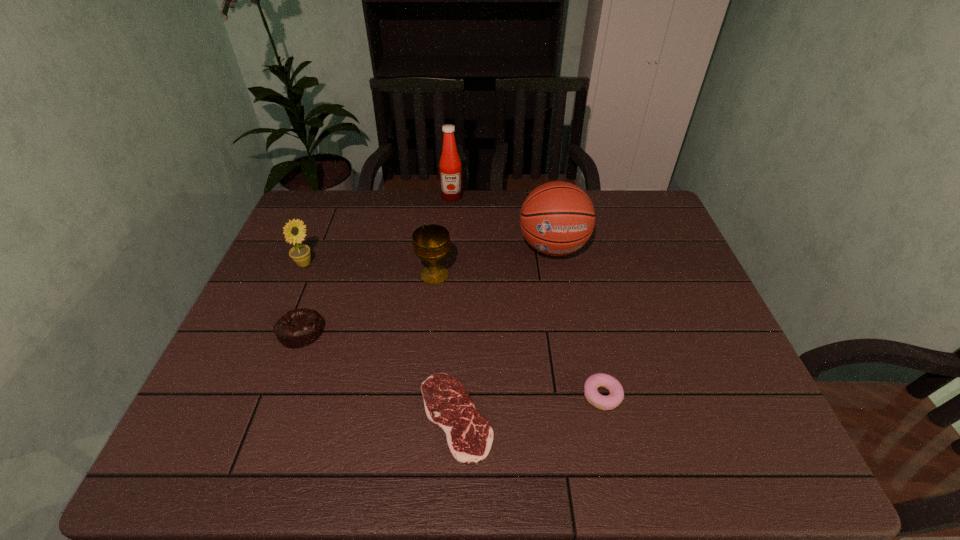
I want to click on vacant space that satisfies the following two spatial constraints: 1. on the back side of the second shortest object; 2. on the face of the sunflower, so click(573, 265).

The width and height of the screenshot is (960, 540). In order to click on vacant space that satisfies the following two spatial constraints: 1. on the face of the fifth tallest object; 2. on the right side of the sunflower in this screenshot , I will do `click(276, 331)`.

The height and width of the screenshot is (540, 960). What are the coordinates of `vacant point that satisfies the following two spatial constraints: 1. on the back side of the sixth tallest object; 2. on the face of the sunflower` in the screenshot? It's located at (573, 265).

Locate an element on the screen. free space in the image that satisfies the following two spatial constraints: 1. on the face of the chalice; 2. on the right side of the sunflower is located at coordinates pos(300,275).

Locate an element on the screen. The height and width of the screenshot is (540, 960). vacant space that satisfies the following two spatial constraints: 1. on the face of the sunflower; 2. on the left side of the beanbag is located at coordinates (276, 331).

The height and width of the screenshot is (540, 960). Identify the location of free space in the image that satisfies the following two spatial constraints: 1. on the face of the fifth tallest object; 2. on the left side of the sunflower. (276, 331).